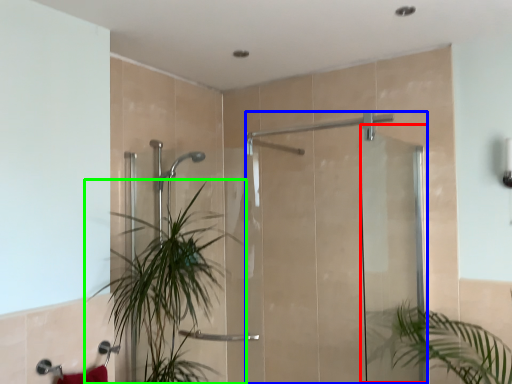
Question: Which object is positioned closest to screen door (highlighted by a red box)? Select from screen door (highlighted by a blue box) and houseplant (highlighted by a green box).

Choices:
 (A) screen door
 (B) houseplant

Answer: (A)